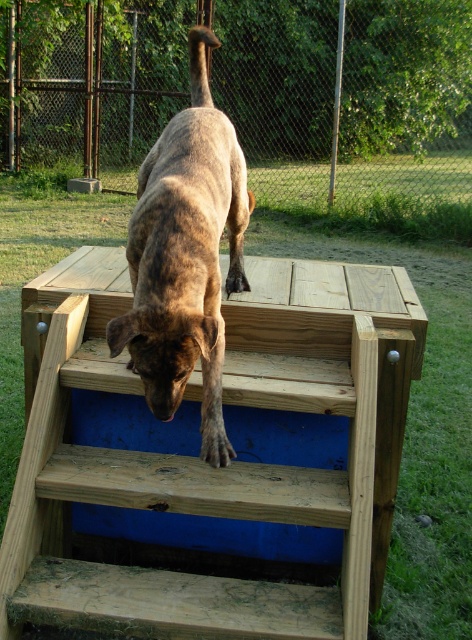
Is wooden stairs at center closer to the viewer compared to brown brindle dog at center?

No, it is not.

Who is more forward, (152,602) or (160,316)?

Point (160,316) is in front.

Does point (247, 604) lie behind point (194, 230)?

No, it is in front of (194, 230).

Find the location of a particular element. The width and height of the screenshot is (472, 640). wooden stairs at center is located at coordinates (184, 513).